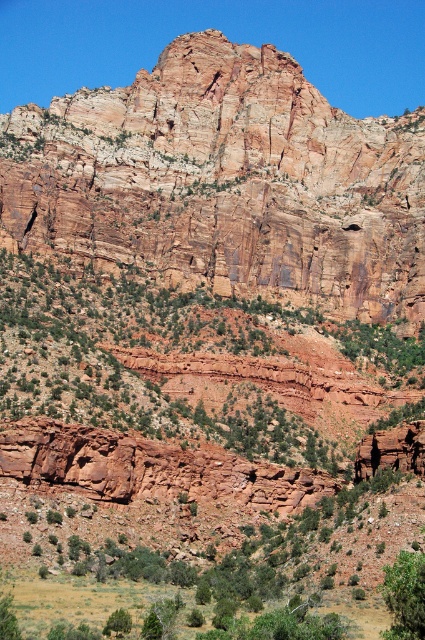
Between rustic rock formation at center and green leafy bush at lower right, which one has more height?

With more height is rustic rock formation at center.

Is rustic rock formation at center closer to the viewer compared to green leafy bush at lower right?

No.

What do you see at coordinates (223, 182) in the screenshot? The width and height of the screenshot is (425, 640). I see `rustic rock formation at center` at bounding box center [223, 182].

Locate an element on the screen. The height and width of the screenshot is (640, 425). rustic rock formation at center is located at coordinates (223, 182).